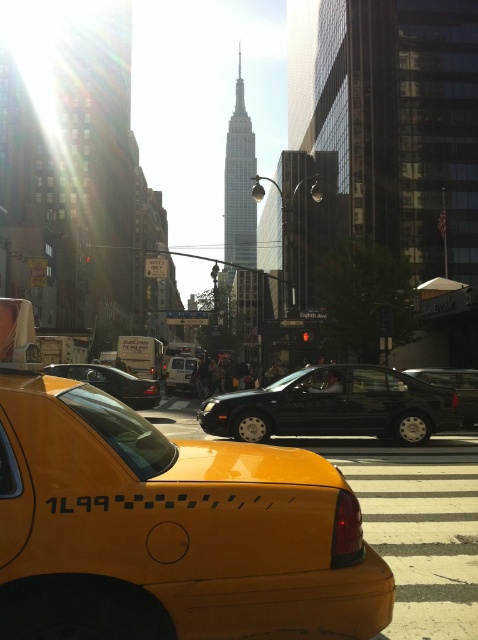
Question: Does yellow plastic taxi at center lie in front of black matte sedan at center?

Choices:
 (A) no
 (B) yes

Answer: (B)

Question: Which object is farther from the camera taking this photo?

Choices:
 (A) black rubber sedan at center
 (B) black matte sedan at center

Answer: (A)

Question: Among these objects, which one is farthest from the camera?

Choices:
 (A) shiny silver sedan at center
 (B) black rubber sedan at center

Answer: (A)

Question: Among these objects, which one is nearest to the camera?

Choices:
 (A) yellow plastic taxi at center
 (B) shiny silver sedan at center
 (C) black rubber sedan at center
 (D) black matte sedan at center

Answer: (A)

Question: Does shiny silver sedan at center have a greater width compared to black rubber sedan at center?

Choices:
 (A) yes
 (B) no

Answer: (B)

Question: Is yellow plastic taxi at center below shiny silver sedan at center?

Choices:
 (A) yes
 (B) no

Answer: (B)